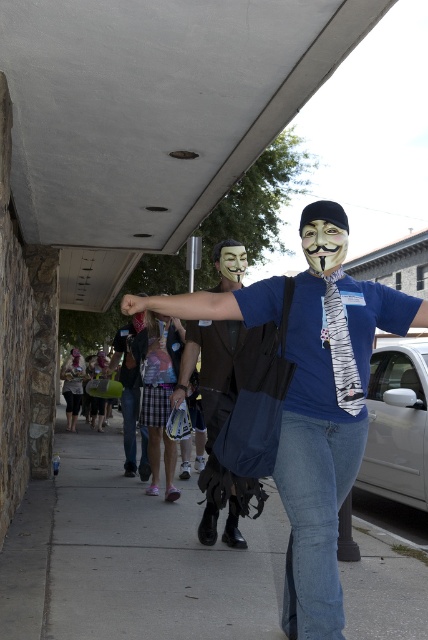
You are a delivery person with a package that is 1.2 meters wide. You need to deliver it along the gray concrete sidewalk at lower center. Considering the width of the sidewalk and the matte brown vest at center, can you safely navigate the sidewalk with your package?

The gray concrete sidewalk at lower center is narrower than the matte brown vest at center, so it may not be wide enough to safely navigate with a 1.2 meter wide package. You should consider an alternative route or check for wider pathways.

You are standing at the origin point in the image. Where is the gray concrete sidewalk at lower center located?

The gray concrete sidewalk at lower center is located at point 0.873 on the x axis and 0.308 on the y axis.

You are standing in the scene and want to take a photo. There are two points marked in the image, point 1 at coordinates point [207,449] and point 2 at coordinates point [339,236]. Which point should you focus on to ensure it appears clearer in your photo?

→ Point 1 at coordinates point [207,449] is closer to the camera, so focusing on it will make it appear clearer in the photo.